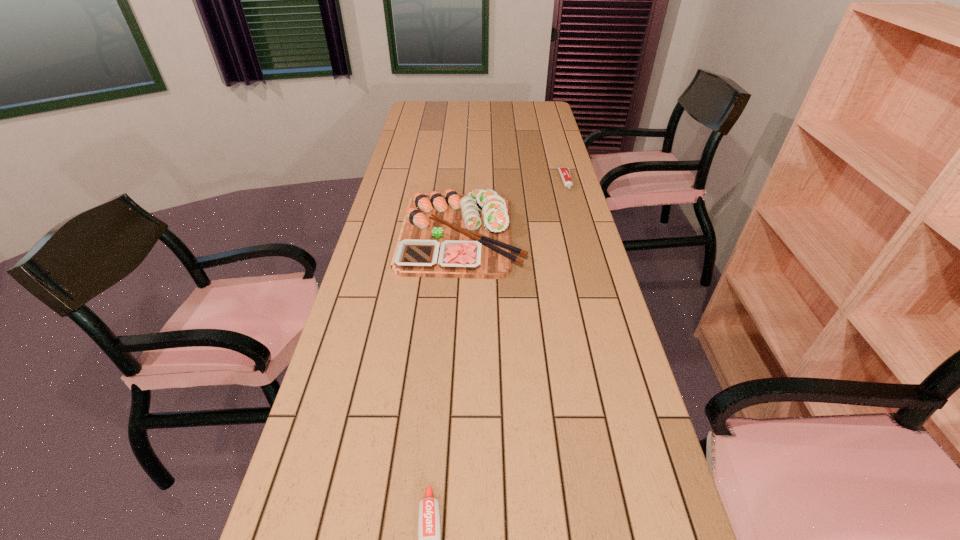
At what (x,y) coordinates should I click in order to perform the action: click on the tallest object. Please return your answer as a coordinate pair (x, y). Looking at the image, I should click on (450, 235).

The width and height of the screenshot is (960, 540). I want to click on platter, so click(450, 235).

You are a GUI agent. You are given a task and a screenshot of the screen. Output one action in this format:
    pyautogui.click(x=<x>, y=<y>)
    Task: Click on the rightmost object
    This screenshot has height=540, width=960.
    Given the screenshot: What is the action you would take?
    pyautogui.click(x=565, y=173)

Find the location of `the farther toothpaste`. the farther toothpaste is located at coordinates (565, 173).

Where is `free space located 0.380m on the back of the tallest object`? free space located 0.380m on the back of the tallest object is located at coordinates (467, 150).

Locate an element on the screen. This screenshot has height=540, width=960. vacant region located at the nozzle of the farther toothpaste is located at coordinates (588, 259).

Locate an element on the screen. The image size is (960, 540). object that is at the left edge is located at coordinates (450, 235).

Where is `object located in the right edge section of the desktop`? The image size is (960, 540). object located in the right edge section of the desktop is located at coordinates (565, 173).

I want to click on vacant area at the far edge of the desktop, so click(470, 110).

In the image, there is a desktop. Identify the location of vacant space at the left edge. This screenshot has height=540, width=960. (396, 144).